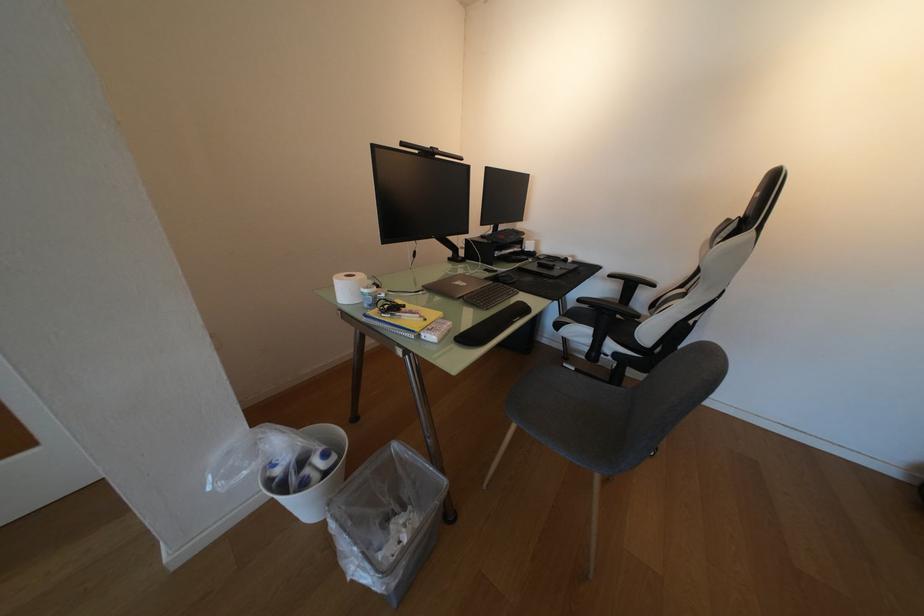
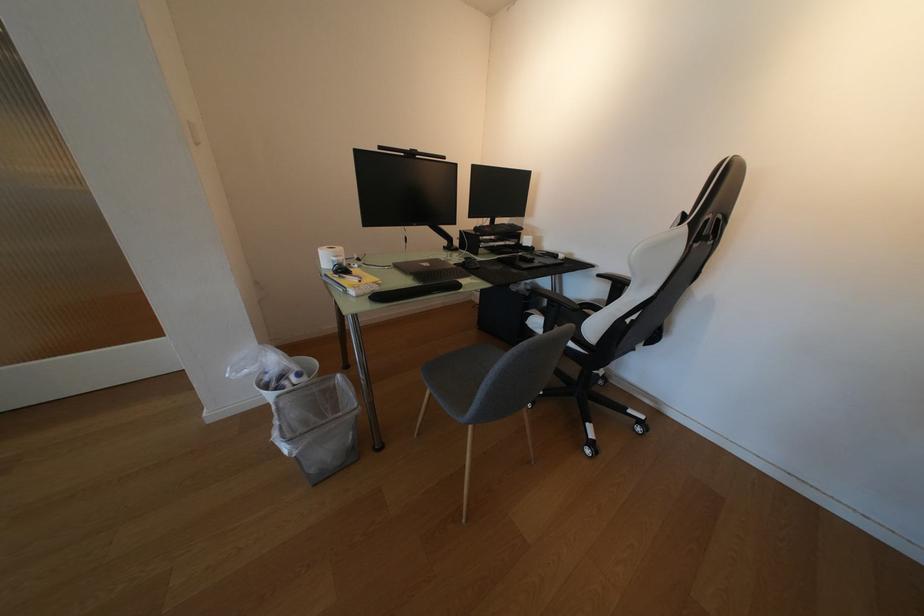
Locate, in the second image, the point that corresponds to point 497,281 in the first image.

(466, 265)